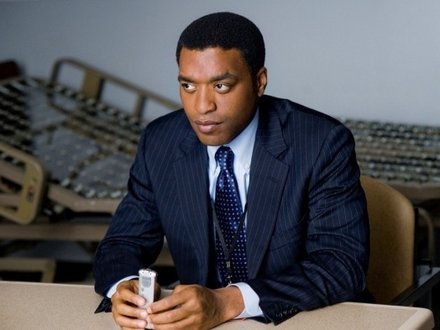
The height and width of the screenshot is (330, 440). Find the location of `table`. table is located at coordinates (366, 313), (22, 305).